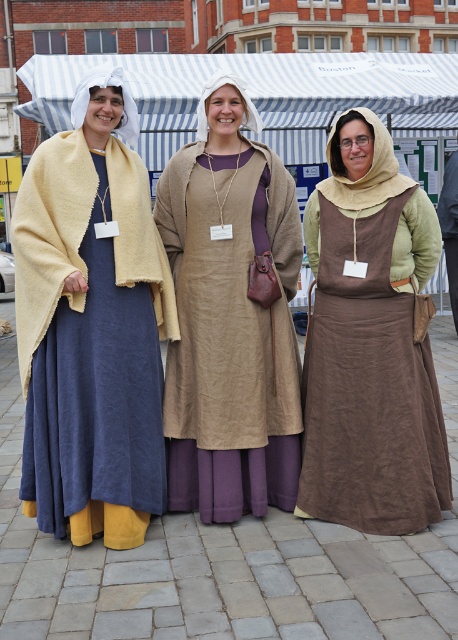
You are at a historical market event and see two items worn by participants. The first is a matte yellow shawl at left, and the second is a brown linen apron at center. Which item is located more to the left in the image?

The matte yellow shawl at left is positioned on the left side of the brown linen apron at center, so it is more to the left.